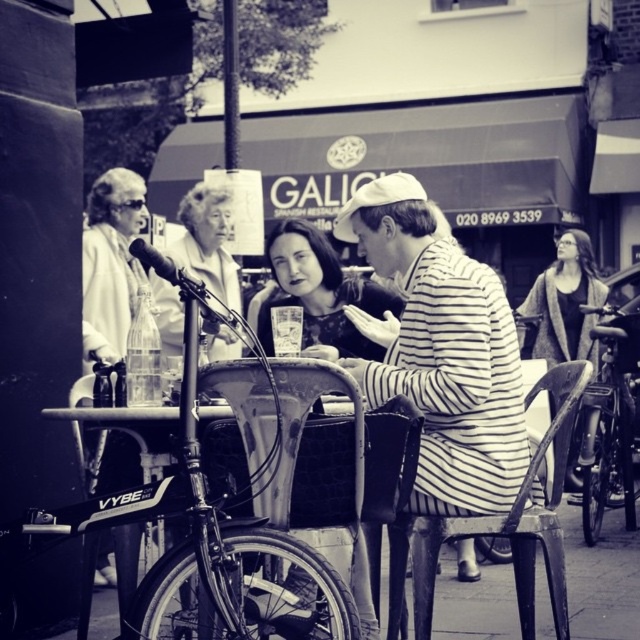
Question: In this image, where is matte gray cardigan at center located relative to metallic/matte microphone at center?

Choices:
 (A) left
 (B) right

Answer: (B)

Question: Among these objects, which one is farthest from the camera?

Choices:
 (A) striped fabric jacket at center
 (B) matte gray cardigan at center

Answer: (B)

Question: Which point appears closest to the camera in this image?

Choices:
 (A) (387, 337)
 (B) (422, 536)

Answer: (B)

Question: Which point is farther to the camera?

Choices:
 (A) (134, 253)
 (B) (612, 388)
 (C) (531, 579)

Answer: (B)

Question: Can you confirm if matte plastic cup at center is positioned to the right of white fabric jacket at center?

Choices:
 (A) yes
 (B) no

Answer: (A)

Question: Is striped fabric jacket at center to the left of metallic/matte microphone at center from the viewer's perspective?

Choices:
 (A) yes
 (B) no

Answer: (B)